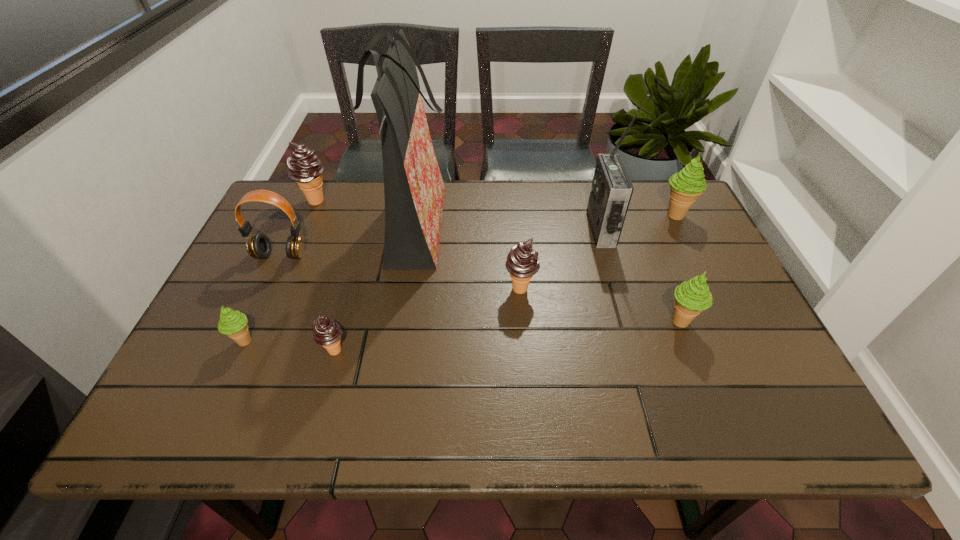
Where is `free area in between the leftmost chocolate icecream and the leftmost green icecream`? Image resolution: width=960 pixels, height=540 pixels. free area in between the leftmost chocolate icecream and the leftmost green icecream is located at coordinates (280, 271).

Locate an element on the screen. vacant space that's between the shopping bag and the headset is located at coordinates (347, 242).

The width and height of the screenshot is (960, 540). What are the coordinates of `free space between the seventh object from left to right and the second green icecream from right to left` in the screenshot? It's located at (641, 276).

Where is `vacant space that's between the leftmost green icecream and the headset`? vacant space that's between the leftmost green icecream and the headset is located at coordinates (263, 298).

Locate an element on the screen. This screenshot has width=960, height=540. unoccupied area between the smallest chocolate icecream and the leftmost green icecream is located at coordinates (290, 346).

Identify the location of object that is the eighth nearest to the leftmost green icecream. 686,185.

Find the location of `object identified as the fourth closest to the smallest green icecream`. object identified as the fourth closest to the smallest green icecream is located at coordinates (304, 166).

Point out which icecream is positioned as the second nearest to the leftmost chocolate icecream. Please provide its 2D coordinates. Your answer should be formatted as a tuple, i.e. [(x, y)], where the tuple contains the x and y coordinates of a point satisfying the conditions above.

[(326, 332)]

You are a GUI agent. You are given a task and a screenshot of the screen. Output one action in this format:
    pyautogui.click(x=<x>, y=<y>)
    Task: Click on the second closest icecream to the leftmost chocolate icecream
    
    Given the screenshot: What is the action you would take?
    pyautogui.click(x=326, y=332)

At what (x,y) coordinates should I click in order to perform the action: click on chocolate icecream that is the closest one to the brown headset. Please return your answer as a coordinate pair (x, y). Image resolution: width=960 pixels, height=540 pixels. Looking at the image, I should click on (304, 166).